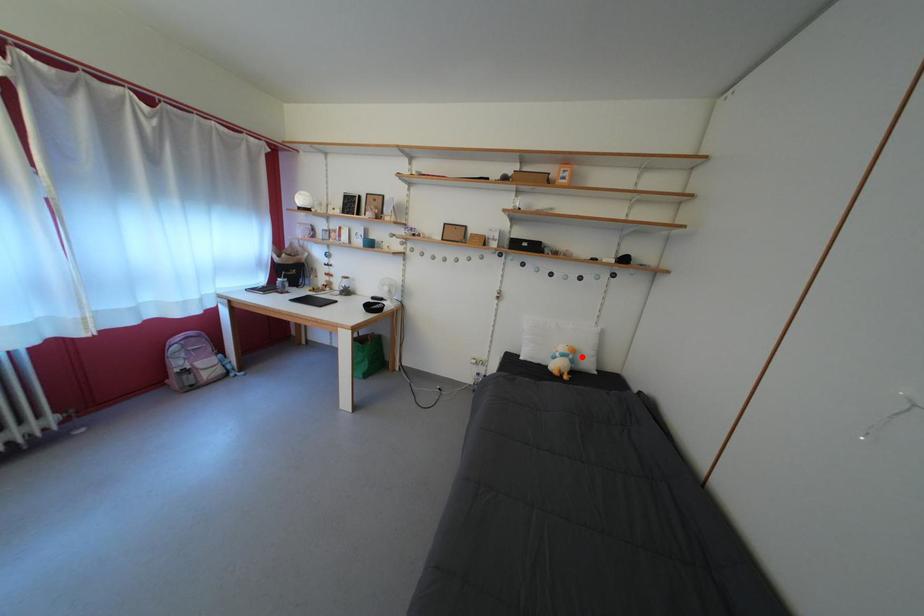
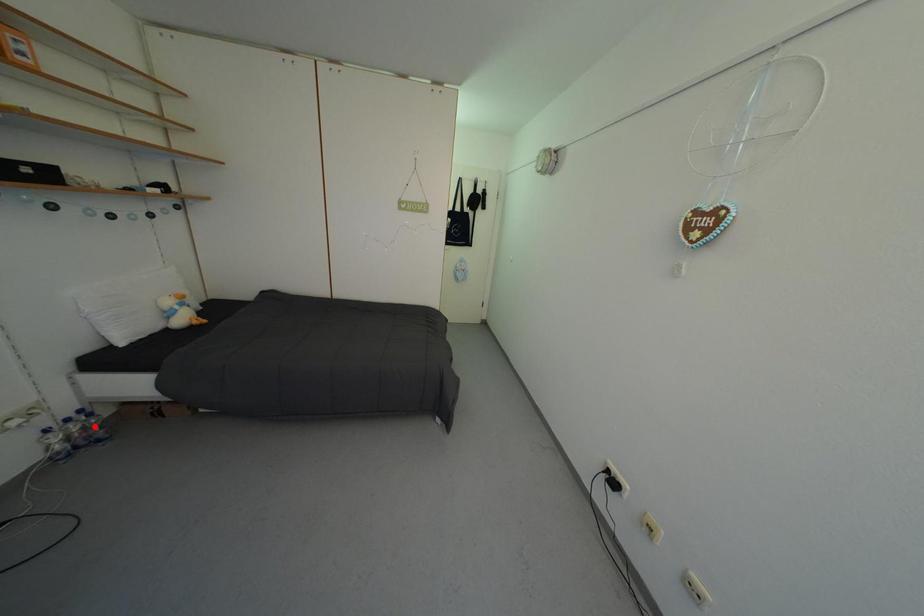
I am providing you with two images of the same scene from different viewpoints. A red point is marked on the first image and another point is marked on the second image. Are the points marked in image1 and image2 representing the same 3D position?

No